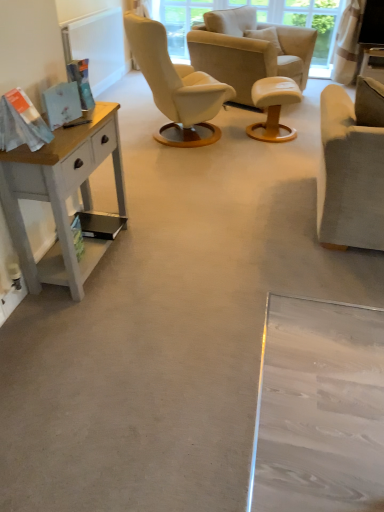
Identify the location of free space in front of white leather stool at center. Image resolution: width=384 pixels, height=512 pixels. (273, 152).